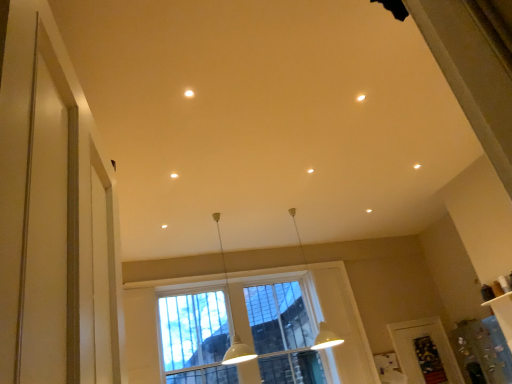
Question: Is white matte pendant light at center, which is the second lamp in left-to-right order, taller or shorter than clear plastic screen door at lower right?

Choices:
 (A) tall
 (B) short

Answer: (A)

Question: Choose the correct answer: Is white matte pendant light at center, which is the second lamp in left-to-right order, inside clear plastic screen door at lower right or outside it?

Choices:
 (A) inside
 (B) outside

Answer: (B)

Question: Which of these objects is positioned farthest from the white glossy pendant light at center, marked as the 2th lamp in a right-to-left arrangement?

Choices:
 (A) white matte pendant light at center, marked as the first lamp in a right-to-left arrangement
 (B) matte white light fixture at upper center
 (C) clear plastic screen door at lower right
 (D) clear glass window at center

Answer: (B)

Question: Considering the real-world distances, which object is closest to the white glossy pendant light at center, placed as the first lamp when sorted from left to right?

Choices:
 (A) white matte pendant light at center, marked as the first lamp in a right-to-left arrangement
 (B) clear plastic screen door at lower right
 (C) matte white light fixture at upper center
 (D) clear glass window at center

Answer: (D)